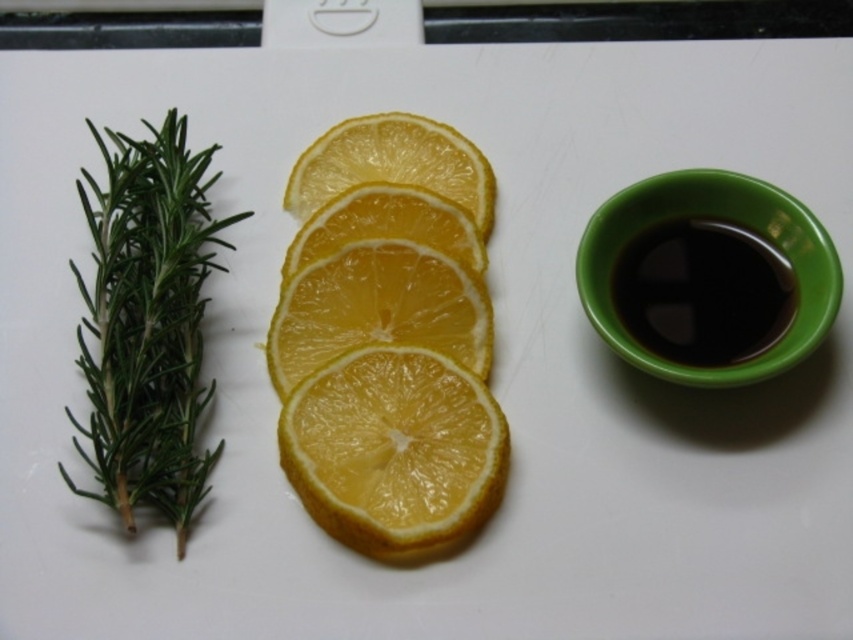
You are standing 1 meter away from the cutting board. Can you reach the point at coordinates point (416, 285) on the cutting board?

The point at coordinates point (416, 285) is 1.34 meters away from you, so you are 0.34 meters too far to reach it.